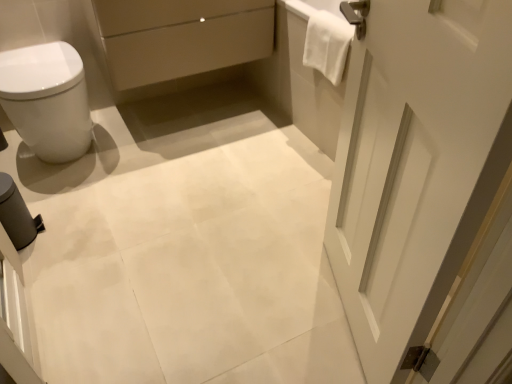
Question: Is white towel at upper right looking in the opposite direction of matte beige drawer at upper center?

Choices:
 (A) yes
 (B) no

Answer: (B)

Question: Is white towel at upper right closer to the viewer compared to matte beige drawer at upper center?

Choices:
 (A) no
 (B) yes

Answer: (B)

Question: From a real-world perspective, is white towel at upper right physically above matte beige drawer at upper center?

Choices:
 (A) yes
 (B) no

Answer: (A)

Question: From a real-world perspective, does white towel at upper right sit lower than matte beige drawer at upper center?

Choices:
 (A) no
 (B) yes

Answer: (A)

Question: Is white towel at upper right next to matte beige drawer at upper center and touching it?

Choices:
 (A) yes
 (B) no

Answer: (B)

Question: Is point (303, 57) positioned closer to the camera than point (4, 69)?

Choices:
 (A) farther
 (B) closer

Answer: (A)

Question: From a real-world perspective, is white towel at upper right physically located above or below white glossy bidet at left?

Choices:
 (A) below
 (B) above

Answer: (B)

Question: Is white towel at upper right in front of or behind white glossy bidet at left in the image?

Choices:
 (A) behind
 (B) front

Answer: (A)

Question: Is white towel at upper right bigger or smaller than white glossy bidet at left?

Choices:
 (A) big
 (B) small

Answer: (B)

Question: From the image's perspective, is white matte door at right located above or below white towel at upper right?

Choices:
 (A) above
 (B) below

Answer: (B)

Question: Looking at the image, does white matte door at right seem bigger or smaller compared to white towel at upper right?

Choices:
 (A) small
 (B) big

Answer: (B)

Question: Looking at their shapes, would you say white matte door at right is wider or thinner than white towel at upper right?

Choices:
 (A) thin
 (B) wide

Answer: (B)

Question: Visually, is white matte door at right positioned to the left or to the right of white towel at upper right?

Choices:
 (A) right
 (B) left

Answer: (B)

Question: Considering the positions of point coord(54,114) and point coord(326,19), is point coord(54,114) closer or farther from the camera than point coord(326,19)?

Choices:
 (A) farther
 (B) closer

Answer: (A)

Question: Considering the relative positions of white glossy bidet at left and white towel at upper right in the image provided, is white glossy bidet at left to the left or to the right of white towel at upper right?

Choices:
 (A) right
 (B) left

Answer: (B)